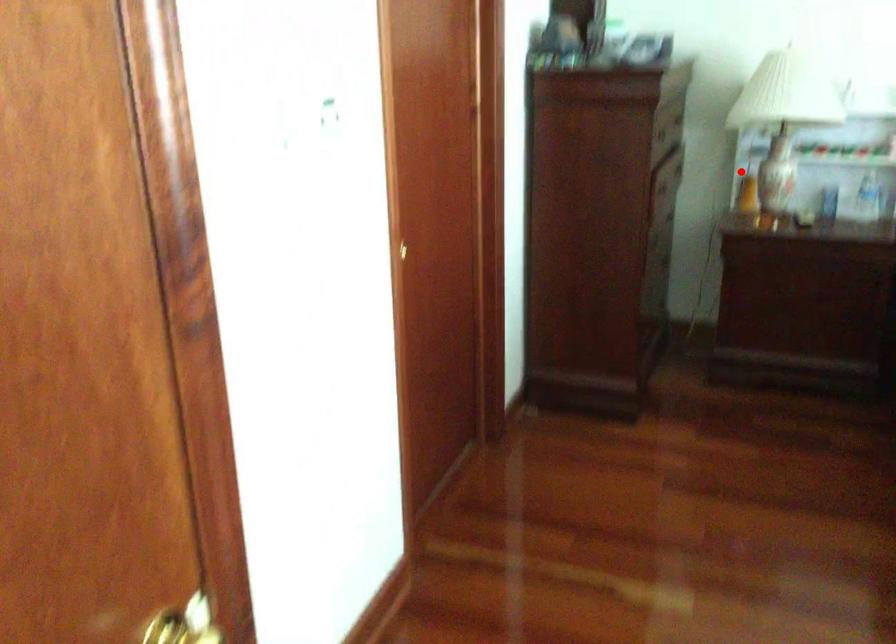
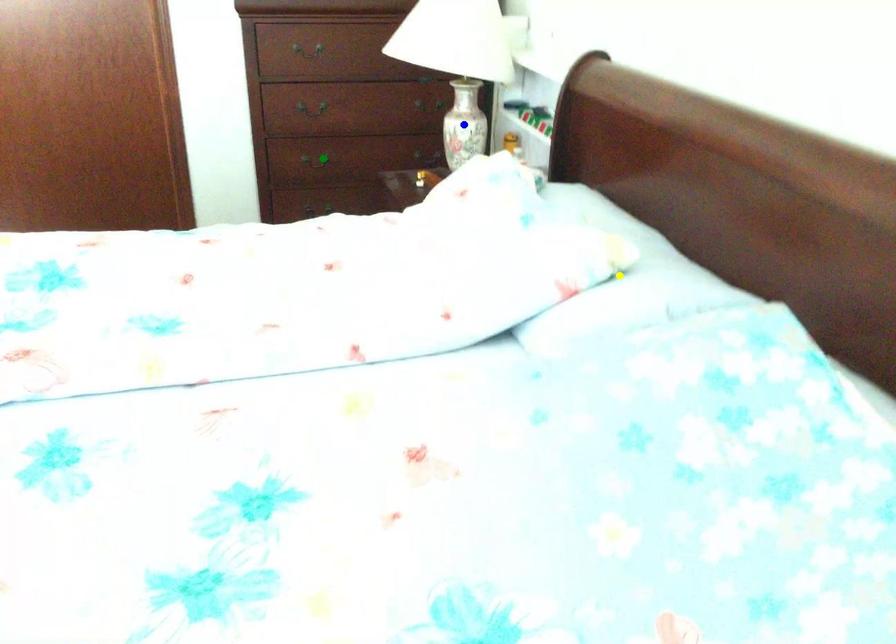
Question: I am providing you with two images of the same scene from different viewpoints. A red point is marked on the first image. You are given multiple points on the second image. Which point in image 2 represents the same 3d spot as the red point in image 1?

Choices:
 (A) blue point
 (B) yellow point
 (C) green point

Answer: (A)